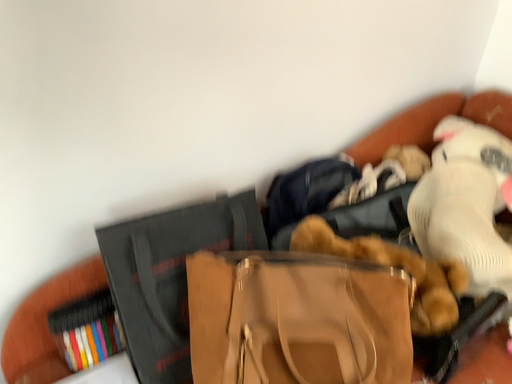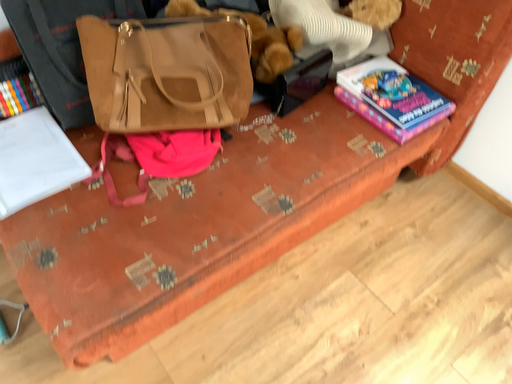
Question: How did the camera likely rotate when shooting the video?

Choices:
 (A) rotated downward
 (B) rotated upward

Answer: (A)